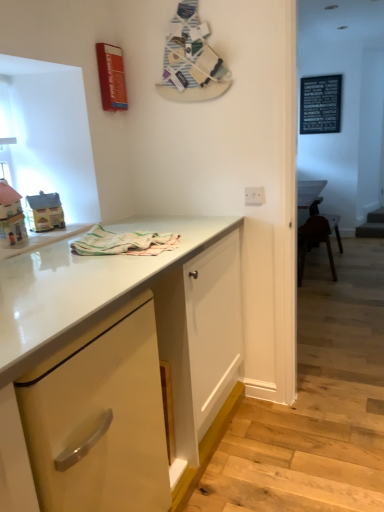
I want to click on matte yellow house at left, the first toy from the back, so click(x=44, y=212).

Image resolution: width=384 pixels, height=512 pixels. Describe the element at coordinates (320, 104) in the screenshot. I see `black matte bulletin board at upper right` at that location.

The height and width of the screenshot is (512, 384). Describe the element at coordinates (83, 285) in the screenshot. I see `matte yellow cabinet at center, which is the first cabinetry from front to back` at that location.

Locate an element on the screen. matte yellow cabinet at center, the second cabinetry when ordered from back to front is located at coordinates (83, 285).

You are a GUI agent. You are given a task and a screenshot of the screen. Output one action in this format:
    pyautogui.click(x=<x>, y=<y>)
    Task: Click on the white glossy electric outlet at upper center
    Image resolution: width=384 pixels, height=512 pixels.
    Given the screenshot: What is the action you would take?
    tap(254, 196)

Locate an element on the screen. matte yellow house at left, the 2th toy positioned from the front is located at coordinates (44, 212).

Can you confirm if matte yellow toy house at left, which is the second toy from back to front, is smaller than matte yellow cabinet at lower left, marked as the 1th cabinetry in a back-to-front arrangement?

Correct, matte yellow toy house at left, which is the second toy from back to front, occupies less space than matte yellow cabinet at lower left, marked as the 1th cabinetry in a back-to-front arrangement.

Considering the sizes of matte yellow toy house at left, which is the second toy from back to front, and matte yellow cabinet at lower left, marked as the 1th cabinetry in a back-to-front arrangement, in the image, is matte yellow toy house at left, which is the second toy from back to front, taller or shorter than matte yellow cabinet at lower left, marked as the 1th cabinetry in a back-to-front arrangement,?

matte yellow toy house at left, which is the second toy from back to front, is shorter than matte yellow cabinet at lower left, marked as the 1th cabinetry in a back-to-front arrangement.

Measure the distance from matte yellow toy house at left, which is the second toy from back to front, to matte yellow cabinet at lower left, the 2th cabinetry in the front-to-back sequence.

matte yellow toy house at left, which is the second toy from back to front, and matte yellow cabinet at lower left, the 2th cabinetry in the front-to-back sequence, are 34.90 inches apart.

From a real-world perspective, which is physically above, matte yellow toy house at left, placed as the first toy when sorted from front to back, or matte yellow cabinet at lower left, marked as the 1th cabinetry in a back-to-front arrangement?

matte yellow toy house at left, placed as the first toy when sorted from front to back.

From a real-world perspective, is matte yellow house at left, the first toy from the back, positioned over white glossy electric outlet at upper center based on gravity?

Yes, from a real-world perspective, matte yellow house at left, the first toy from the back, is on top of white glossy electric outlet at upper center.

From the image's perspective, which is below, matte yellow house at left, the 2th toy positioned from the front, or white glossy electric outlet at upper center?

From the image's view, matte yellow house at left, the 2th toy positioned from the front, is below.

Would you say matte yellow house at left, the 2th toy positioned from the front, contains white glossy electric outlet at upper center?

No, white glossy electric outlet at upper center is not inside matte yellow house at left, the 2th toy positioned from the front.

Considering the positions of objects matte yellow house at left, the 2th toy positioned from the front, and white glossy electric outlet at upper center in the image provided, who is more to the left, matte yellow house at left, the 2th toy positioned from the front, or white glossy electric outlet at upper center?

matte yellow house at left, the 2th toy positioned from the front.

Does point (310, 91) come closer to viewer compared to point (170, 261)?

No, it is behind (170, 261).

Would you consider black matte bulletin board at upper right to be distant from matte yellow cabinet at center, the second cabinetry when ordered from back to front?

Yes, black matte bulletin board at upper right is far from matte yellow cabinet at center, the second cabinetry when ordered from back to front.

Can we say black matte bulletin board at upper right lies outside matte yellow cabinet at center, which is the first cabinetry from front to back?

Absolutely, black matte bulletin board at upper right is external to matte yellow cabinet at center, which is the first cabinetry from front to back.

Which is behind, pastel striped cloth at center or matte yellow house at left, the 2th toy positioned from the front?

matte yellow house at left, the 2th toy positioned from the front, is further from the camera.

Is pastel striped cloth at center spatially inside matte yellow house at left, the first toy from the back, or outside of it?

pastel striped cloth at center lies outside matte yellow house at left, the first toy from the back.

Can you confirm if pastel striped cloth at center is positioned to the right of matte yellow house at left, the first toy from the back?

Correct, you'll find pastel striped cloth at center to the right of matte yellow house at left, the first toy from the back.

Is matte yellow house at left, the first toy from the back, at the back of pastel striped cloth at center?

Absolutely, pastel striped cloth at center is directed away from matte yellow house at left, the first toy from the back.

Looking at their sizes, would you say matte yellow cabinet at center, the second cabinetry when ordered from back to front, is wider or thinner than pastel striped cloth at center?

Clearly, matte yellow cabinet at center, the second cabinetry when ordered from back to front, has more width compared to pastel striped cloth at center.

In the image, is matte yellow cabinet at center, which is the first cabinetry from front to back, positioned in front of or behind pastel striped cloth at center?

matte yellow cabinet at center, which is the first cabinetry from front to back, is positioned closer to the viewer than pastel striped cloth at center.

How different are the orientations of matte yellow cabinet at center, which is the first cabinetry from front to back, and pastel striped cloth at center in degrees?

matte yellow cabinet at center, which is the first cabinetry from front to back, and pastel striped cloth at center are facing 0.833 degrees away from each other.

From the image's perspective, is white glossy electric outlet at upper center beneath matte yellow house at left, the first toy from the back?

Incorrect, from the image's perspective, white glossy electric outlet at upper center is higher than matte yellow house at left, the first toy from the back.

Does white glossy electric outlet at upper center have a greater height compared to matte yellow house at left, the 2th toy positioned from the front?

No.

Between white glossy electric outlet at upper center and matte yellow house at left, the first toy from the back, which one has smaller size?

With smaller size is white glossy electric outlet at upper center.

At what (x,y) coordinates should I click in order to perform the action: click on the 1st toy below when counting from the white glossy electric outlet at upper center (from the image's perspective). Please return your answer as a coordinate pair (x, y). This screenshot has height=512, width=384. Looking at the image, I should click on (44, 212).

From the image's perspective, which one is positioned lower, black matte bulletin board at upper right or pastel striped cloth at center?

From the image's view, pastel striped cloth at center is below.

Can you confirm if black matte bulletin board at upper right is positioned to the right of pastel striped cloth at center?

Indeed, black matte bulletin board at upper right is positioned on the right side of pastel striped cloth at center.

Can you tell me how much black matte bulletin board at upper right and pastel striped cloth at center differ in facing direction?

The angular difference between black matte bulletin board at upper right and pastel striped cloth at center is 90.4 degrees.

From a real-world perspective, does black matte bulletin board at upper right sit lower than pastel striped cloth at center?

Actually, black matte bulletin board at upper right is physically above pastel striped cloth at center in the real world.

Where is `the 1st cabinetry counting from the right side of the matte yellow toy house at left, placed as the first toy when sorted from front to back`? the 1st cabinetry counting from the right side of the matte yellow toy house at left, placed as the first toy when sorted from front to back is located at coordinates (99, 418).

In the image, there is a matte yellow house at left, the 2th toy positioned from the front. What are the coordinates of `electric outlet above it (from the image's perspective)` in the screenshot? It's located at (254, 196).

When comparing their distances from black matte bulletin board at upper right, does matte yellow cabinet at lower left, marked as the 1th cabinetry in a back-to-front arrangement, or matte yellow cabinet at center, which is the first cabinetry from front to back, seem closer?

matte yellow cabinet at center, which is the first cabinetry from front to back.

Based on the photo, estimate the real-world distances between objects in this image. Which object is further from matte yellow cabinet at center, which is the first cabinetry from front to back, black matte bulletin board at upper right or matte yellow cabinet at lower left, marked as the 1th cabinetry in a back-to-front arrangement?

black matte bulletin board at upper right.

From the image, which object appears to be farther from matte yellow house at left, the 2th toy positioned from the front, black matte bulletin board at upper right or white glossy electric outlet at upper center?

The object further to matte yellow house at left, the 2th toy positioned from the front, is black matte bulletin board at upper right.

When comparing their distances from black matte bulletin board at upper right, does matte yellow toy house at left, placed as the first toy when sorted from front to back, or matte yellow house at left, the first toy from the back, seem closer?

matte yellow house at left, the first toy from the back, lies closer to black matte bulletin board at upper right than the other object.

Which object lies further to the anchor point matte yellow cabinet at lower left, the 2th cabinetry in the front-to-back sequence, white glossy electric outlet at upper center or pastel striped cloth at center?

Among the two, white glossy electric outlet at upper center is located further to matte yellow cabinet at lower left, the 2th cabinetry in the front-to-back sequence.

Considering their positions, is matte yellow cabinet at center, the second cabinetry when ordered from back to front, positioned closer to black matte bulletin board at upper right than white glossy electric outlet at upper center?

The object closer to black matte bulletin board at upper right is white glossy electric outlet at upper center.

Considering their positions, is matte yellow house at left, the 2th toy positioned from the front, positioned closer to black matte bulletin board at upper right than matte yellow toy house at left, placed as the first toy when sorted from front to back?

matte yellow house at left, the 2th toy positioned from the front, lies closer to black matte bulletin board at upper right than the other object.

Which object lies further to the anchor point matte yellow toy house at left, which is the second toy from back to front, white glossy electric outlet at upper center or black matte bulletin board at upper right?

black matte bulletin board at upper right lies further to matte yellow toy house at left, which is the second toy from back to front, than the other object.

Where is `electric outlet positioned between matte yellow cabinet at lower left, marked as the 1th cabinetry in a back-to-front arrangement, and black matte bulletin board at upper right from near to far`? The height and width of the screenshot is (512, 384). electric outlet positioned between matte yellow cabinet at lower left, marked as the 1th cabinetry in a back-to-front arrangement, and black matte bulletin board at upper right from near to far is located at coordinates (254, 196).

At what (x,y) coordinates should I click in order to perform the action: click on toy between matte yellow cabinet at center, the second cabinetry when ordered from back to front, and matte yellow house at left, the first toy from the back, along the z-axis. Please return your answer as a coordinate pair (x, y). This screenshot has width=384, height=512. Looking at the image, I should click on (11, 216).

Locate an element on the screen. Image resolution: width=384 pixels, height=512 pixels. cabinetry between matte yellow cabinet at center, the second cabinetry when ordered from back to front, and white glossy electric outlet at upper center, along the z-axis is located at coordinates (99, 418).

Where is `material between matte yellow cabinet at lower left, marked as the 1th cabinetry in a back-to-front arrangement, and black matte bulletin board at upper right in the front-back direction`? material between matte yellow cabinet at lower left, marked as the 1th cabinetry in a back-to-front arrangement, and black matte bulletin board at upper right in the front-back direction is located at coordinates (123, 243).